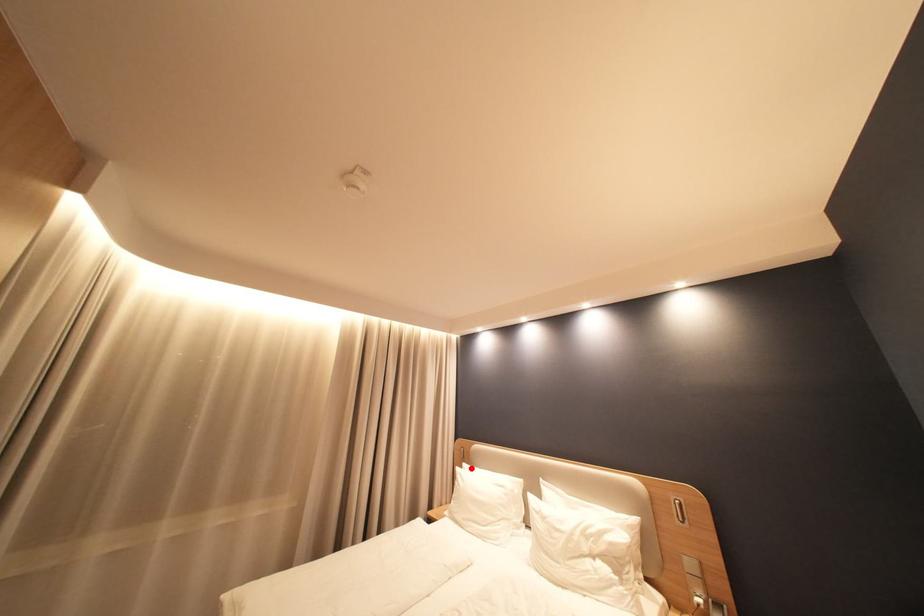
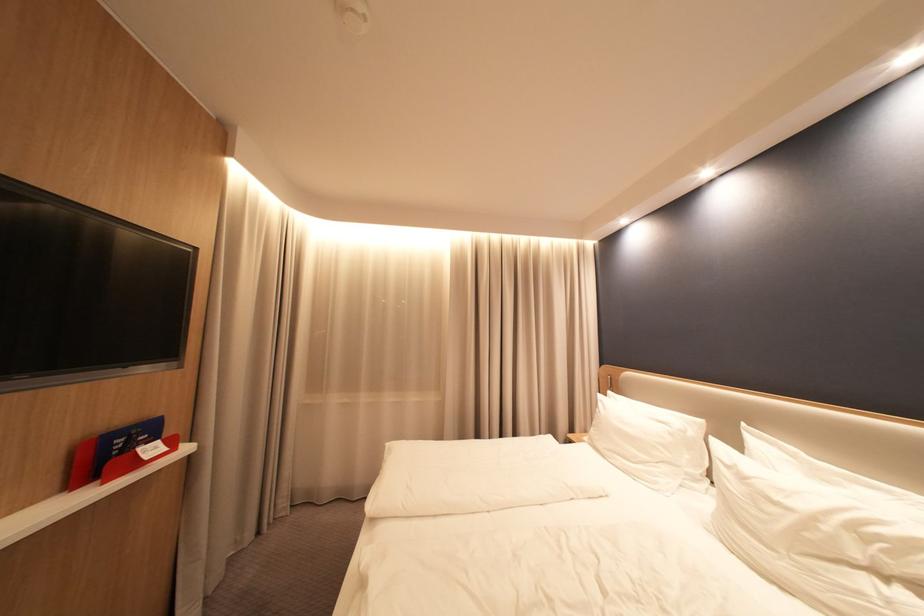
Where in the second image is the point corresponding to the highlighted location from the first image?

(615, 397)